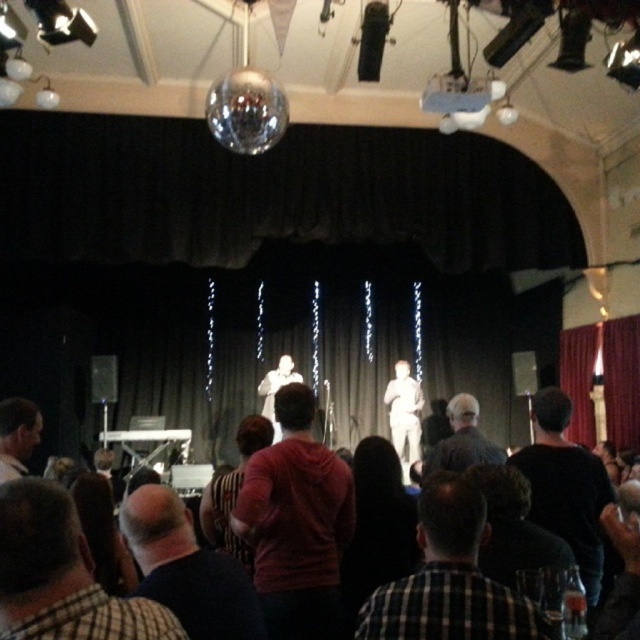
Does checkered fabric shirt at center appear under matte white shirt at center?

No.

Where is `checkered fabric shirt at center`? This screenshot has width=640, height=640. checkered fabric shirt at center is located at coordinates (449, 579).

Who is more forward, [42,593] or [150,538]?

Point [42,593]

Can you confirm if dark brown hair at lower left is positioned above dark blue shirt at center?

Correct, dark brown hair at lower left is located above dark blue shirt at center.

In order to click on dark brown hair at lower left in this screenshot , I will do `click(60, 576)`.

Which is below, checkered fabric shirt at center or black matte shirt at center?

black matte shirt at center is below.

Is checkered fabric shirt at center closer to camera compared to black matte shirt at center?

Yes, checkered fabric shirt at center is closer to the viewer.

Is point (433, 522) positioned in front of point (556, 422)?

Yes, it is in front of point (556, 422).

Find the location of a particular element. checkered fabric shirt at center is located at coordinates tap(449, 579).